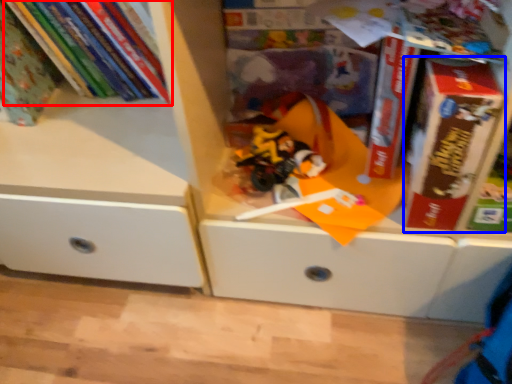
Question: Which point is closer to the camera, book (highlighted by a red box) or paperback book (highlighted by a blue box)?

Choices:
 (A) book
 (B) paperback book

Answer: (B)